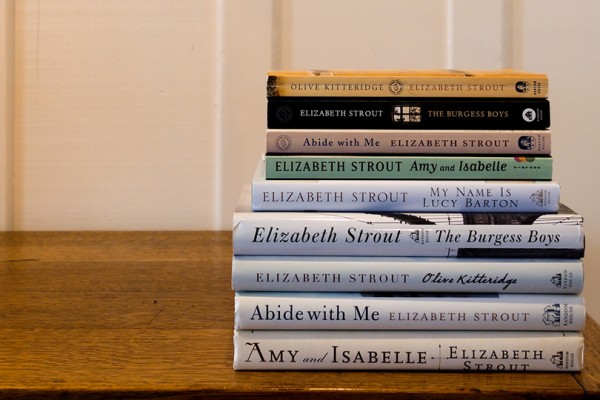
In order to click on horizontally laying book in this screenshot , I will do `click(387, 364)`, `click(415, 306)`, `click(423, 282)`, `click(430, 241)`, `click(435, 203)`, `click(441, 168)`, `click(448, 145)`, `click(459, 113)`, `click(451, 87)`.